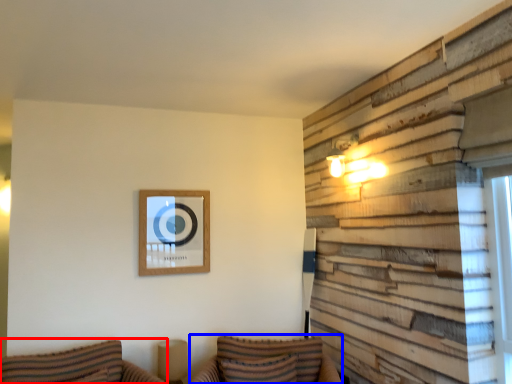
Question: Among these objects, which one is nearest to the camera, couch (highlighted by a red box) or couch (highlighted by a blue box)?

Choices:
 (A) couch
 (B) couch

Answer: (A)